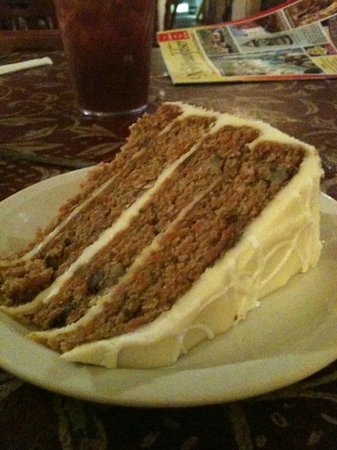
Identify the location of table. The height and width of the screenshot is (450, 337). (171, 85).